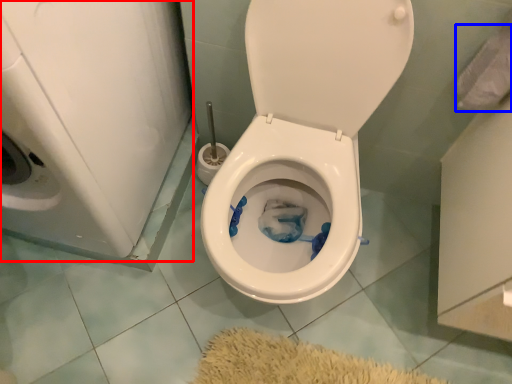
Question: Which object appears farthest to the camera in this image, washer (highlighted by a red box) or toilet paper (highlighted by a blue box)?

Choices:
 (A) washer
 (B) toilet paper

Answer: (B)